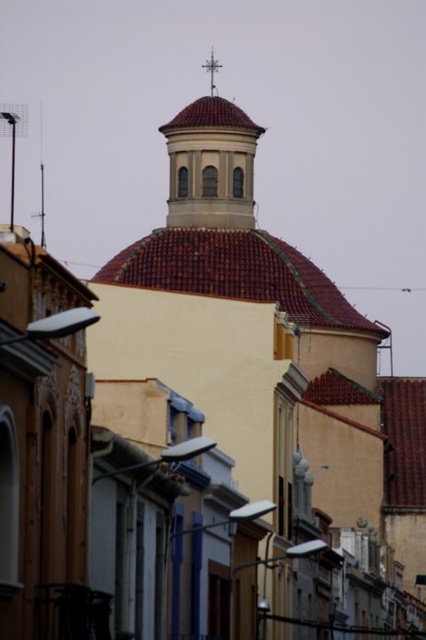
You are an architect analyzing the structure of the building in the image. Which object is positioned higher relative to the other between the matte red tile dome at center and the metallic cross at upper center?

The metallic cross at upper center is positioned higher than the matte red tile dome at center.

You are an architect designing a new streetlight for the area near the matte red tile dome at center and the metallic cross at upper center. Considering their heights, which object should the streetlight be placed closer to to ensure visibility?

The matte red tile dome at center is much taller than the metallic cross at upper center, so the streetlight should be placed closer to the metallic cross at upper center to ensure visibility.

You are a photographer standing on the sidewalk in front of the dome structure. You want to capture both the matte red tile dome at center and the metallic cross at upper center in a single shot. Which object should you position closer to the left side of your camera frame to ensure both are visible?

To ensure both the matte red tile dome at center and the metallic cross at upper center are visible in the frame, position the metallic cross at upper center closer to the left side of your camera frame since the matte red tile dome at center is to the right of it.